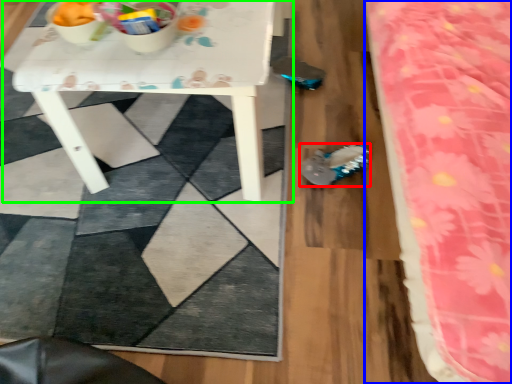
Question: Which is farther away from footwear (highlighted by a red box)? bed (highlighted by a blue box) or table (highlighted by a green box)?

Choices:
 (A) bed
 (B) table

Answer: (A)